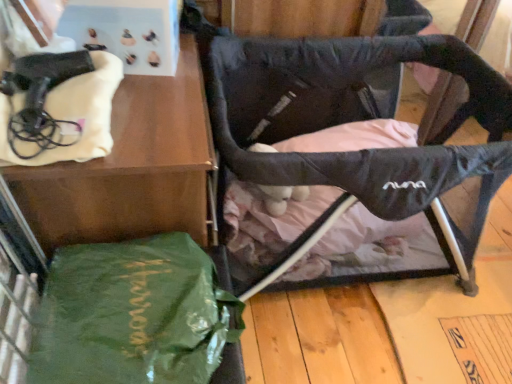
The width and height of the screenshot is (512, 384). I want to click on vacant space situated above green shiny tote bag at lower left (from a real-world perspective), so point(129,296).